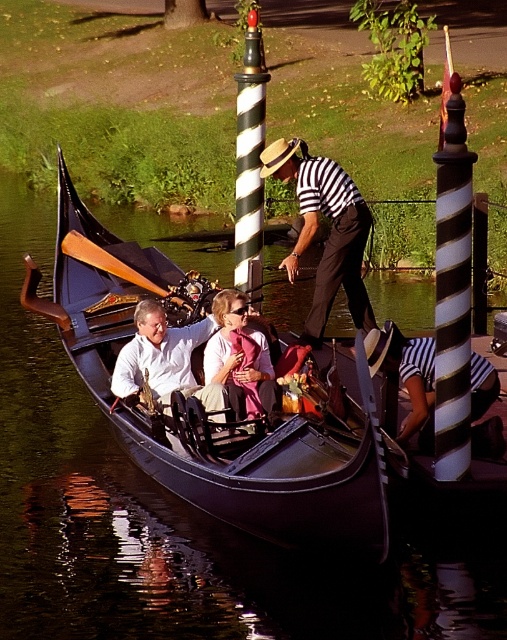
Does striped fabric referee at center have a lesser width compared to black and white striped pole at center?

No.

Can you confirm if striped fabric referee at center is wider than black and white striped pole at center?

Yes.

Between point (330, 166) and point (258, 230), which one is positioned behind?

Positioned behind is point (258, 230).

Locate an element on the screen. The width and height of the screenshot is (507, 640). striped fabric referee at center is located at coordinates (329, 234).

Is point (295, 147) farther from viewer compared to point (190, 390)?

Yes, point (295, 147) is farther from viewer.

Does striped fabric referee at center lie behind white matte shirt at center?

Yes.

The image size is (507, 640). I want to click on striped fabric referee at center, so click(329, 234).

Between black polished wood gondola at center and white matte shirt at center, which one appears on the right side from the viewer's perspective?

black polished wood gondola at center is more to the right.

Between black polished wood gondola at center and white matte shirt at center, which one has more height?

With more height is black polished wood gondola at center.

Who is more forward, (344,432) or (146,312)?

Point (344,432) is more forward.

This screenshot has width=507, height=640. Find the location of `black polished wood gondola at center`. black polished wood gondola at center is located at coordinates click(208, 400).